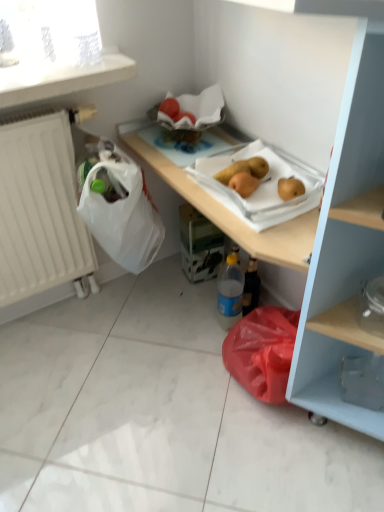
What are the coordinates of `vacant area that lies between transparent plastic carton at center and blue plastic bottle at lower center` in the screenshot? It's located at (217, 295).